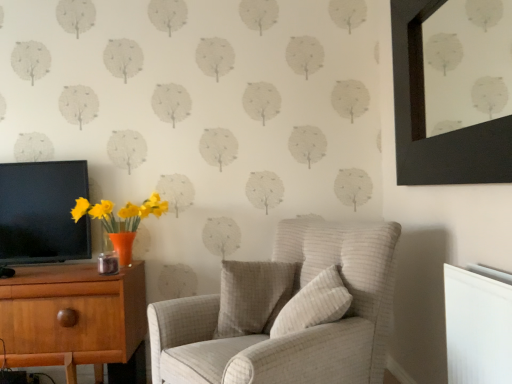
Question: Can you confirm if black matte picture frame at upper right is wider than light beige fabric armchair at center?

Choices:
 (A) yes
 (B) no

Answer: (B)

Question: Could light beige fabric armchair at center be considered to be inside black matte picture frame at upper right?

Choices:
 (A) yes
 (B) no

Answer: (B)

Question: From a real-world perspective, is black matte picture frame at upper right located higher than light beige fabric armchair at center?

Choices:
 (A) no
 (B) yes

Answer: (B)

Question: Does black matte picture frame at upper right have a lesser width compared to light beige fabric armchair at center?

Choices:
 (A) yes
 (B) no

Answer: (A)

Question: Is black matte picture frame at upper right at the right side of light beige fabric armchair at center?

Choices:
 (A) no
 (B) yes

Answer: (B)

Question: Is black matte picture frame at upper right bigger than light beige fabric armchair at center?

Choices:
 (A) no
 (B) yes

Answer: (A)

Question: From the image's perspective, is beige textured pillow at center, acting as the 2th pillow starting from the back, above textured white pillow at center, which is counted as the first pillow, starting from the back?

Choices:
 (A) yes
 (B) no

Answer: (A)

Question: Is beige textured pillow at center, marked as the first pillow in a front-to-back arrangement, next to textured white pillow at center, the 2th pillow positioned from the front?

Choices:
 (A) no
 (B) yes

Answer: (A)

Question: Does beige textured pillow at center, acting as the 2th pillow starting from the back, have a smaller size compared to textured white pillow at center, the 2th pillow positioned from the front?

Choices:
 (A) no
 (B) yes

Answer: (A)

Question: Is beige textured pillow at center, acting as the 2th pillow starting from the back, positioned behind textured white pillow at center, which is counted as the first pillow, starting from the back?

Choices:
 (A) no
 (B) yes

Answer: (A)

Question: Considering the relative sizes of beige textured pillow at center, marked as the first pillow in a front-to-back arrangement, and textured white pillow at center, which is counted as the first pillow, starting from the back, in the image provided, is beige textured pillow at center, marked as the first pillow in a front-to-back arrangement, taller than textured white pillow at center, which is counted as the first pillow, starting from the back,?

Choices:
 (A) no
 (B) yes

Answer: (A)

Question: Could textured white pillow at center, which is counted as the first pillow, starting from the back, be considered to be inside beige textured pillow at center, acting as the 2th pillow starting from the back?

Choices:
 (A) no
 (B) yes

Answer: (A)

Question: Is black glossy tv at left thinner than beige textured pillow at center, acting as the 2th pillow starting from the back?

Choices:
 (A) yes
 (B) no

Answer: (A)